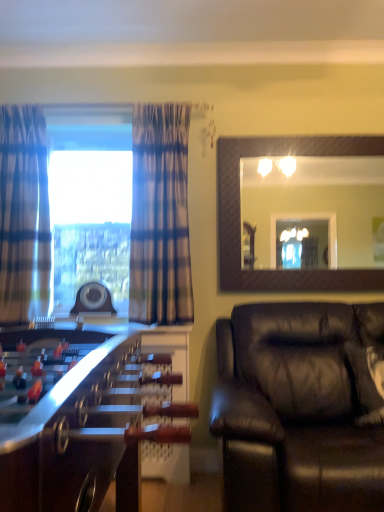
Question: From the image's perspective, is plaid fabric curtain at left, arranged as the second curtain when viewed from the right, located above or below black leather couch at lower right?

Choices:
 (A) below
 (B) above

Answer: (B)

Question: Considering the positions of plaid fabric curtain at left, arranged as the second curtain when viewed from the right, and black leather couch at lower right in the image, is plaid fabric curtain at left, arranged as the second curtain when viewed from the right, bigger or smaller than black leather couch at lower right?

Choices:
 (A) big
 (B) small

Answer: (B)

Question: Which of these objects is positioned closest to the matte brown mirror at upper right?

Choices:
 (A) wooden foosball table at left
 (B) black leather couch at lower right
 (C) plaid fabric curtain at left, acting as the 1th curtain starting from the left
 (D) plaid fabric curtain at left, the 1th curtain from the right

Answer: (D)

Question: Which of these objects is positioned farthest from the plaid fabric curtain at left, arranged as the second curtain when viewed from the right?

Choices:
 (A) black leather couch at lower right
 (B) wooden foosball table at left
 (C) matte brown mirror at upper right
 (D) plaid fabric curtain at left, which is the 2th curtain from left to right

Answer: (A)